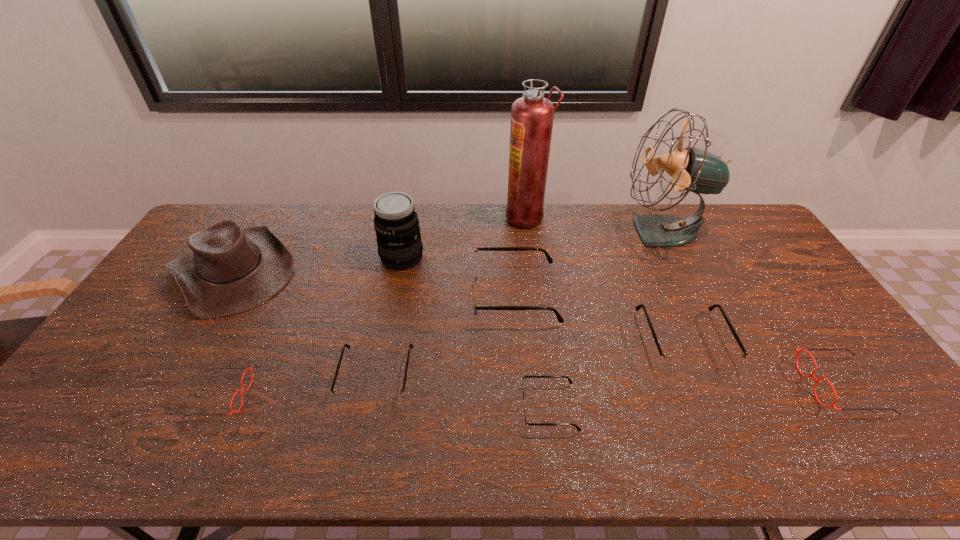
The width and height of the screenshot is (960, 540). What are the coordinates of `the leftmost black spectacles` in the screenshot? It's located at (388, 397).

Identify the location of the fifth spectacles from right to left. (388, 397).

I want to click on the left red spectacles, so tap(250, 369).

The image size is (960, 540). I want to click on the smaller red spectacles, so click(x=250, y=369).

Where is `the smallest black spectacles`? The height and width of the screenshot is (540, 960). the smallest black spectacles is located at coordinates (527, 423).

I want to click on vacant region located on the side of the fire extinguisher with the label, so click(x=449, y=217).

Where is `vacant position located 0.360m on the side of the fire extinguisher with the label`? vacant position located 0.360m on the side of the fire extinguisher with the label is located at coordinates (410, 217).

Find the location of `free region located 0.320m on the side of the fire extinguisher with the label`. free region located 0.320m on the side of the fire extinguisher with the label is located at coordinates [420, 217].

Where is `free spot located 0.130m on the front-facing side of the blue fan for air flow`? This screenshot has height=540, width=960. free spot located 0.130m on the front-facing side of the blue fan for air flow is located at coordinates (585, 232).

Identify the location of free point located on the front-facing side of the blue fan for air flow. (565, 232).